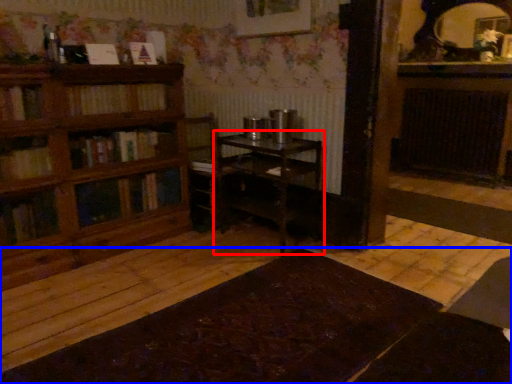
Question: Which object is further to the camera taking this photo, table (highlighted by a red box) or table (highlighted by a blue box)?

Choices:
 (A) table
 (B) table

Answer: (A)